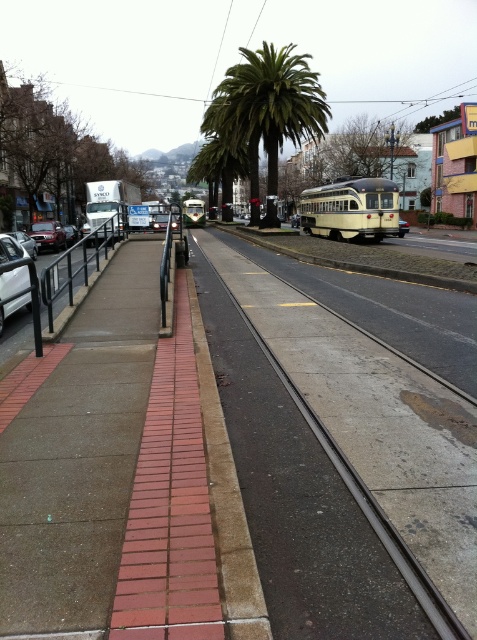
Question: Which point appears closest to the camera in this image?

Choices:
 (A) (219, 577)
 (B) (40, 224)
 (C) (376, 468)

Answer: (A)

Question: Can you confirm if brick at center is wider than shiny silver car at left?

Choices:
 (A) yes
 (B) no

Answer: (B)

Question: Estimate the real-world distances between objects in this image. Which object is closer to the brick at center?

Choices:
 (A) shiny silver car at left
 (B) shiny silver sedan at left
 (C) white matte car at left
 (D) concrete track at center

Answer: (D)

Question: Is white matte car at left positioned behind shiny silver sedan at left?

Choices:
 (A) yes
 (B) no

Answer: (B)

Question: Which object appears farthest from the camera in this image?

Choices:
 (A) concrete track at center
 (B) shiny silver sedan at left

Answer: (B)

Question: Does white matte car at left have a smaller size compared to shiny silver car at left?

Choices:
 (A) yes
 (B) no

Answer: (A)